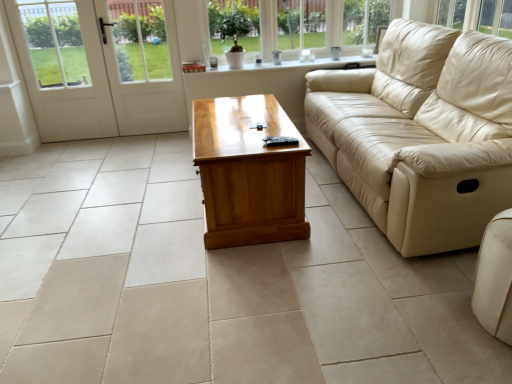
Question: Is clear glass window at upper center facing away from beige leather couch at right, positioned as the 2th studio couch in bottom-to-top order?

Choices:
 (A) no
 (B) yes

Answer: (A)

Question: From a real-world perspective, does clear glass window at upper center stand above beige leather couch at right, the 1th studio couch positioned from the top?

Choices:
 (A) no
 (B) yes

Answer: (B)

Question: From the image's perspective, is clear glass window at upper center on beige leather couch at right, the second studio couch when ordered from front to back?

Choices:
 (A) yes
 (B) no

Answer: (A)

Question: Is the depth of clear glass window at upper center less than that of beige leather couch at right, the 1th studio couch positioned from the top?

Choices:
 (A) yes
 (B) no

Answer: (B)

Question: Is clear glass window at upper center outside beige leather couch at right, marked as the first studio couch in a back-to-front arrangement?

Choices:
 (A) yes
 (B) no

Answer: (A)

Question: Looking at the image, does white wooden screen door at left seem bigger or smaller compared to light brown wood coffee table at center?

Choices:
 (A) big
 (B) small

Answer: (B)

Question: Is white wooden screen door at left inside the boundaries of light brown wood coffee table at center, or outside?

Choices:
 (A) outside
 (B) inside

Answer: (A)

Question: Is point (174, 31) positioned closer to the camera than point (233, 124)?

Choices:
 (A) closer
 (B) farther

Answer: (B)

Question: Based on their positions, is white wooden screen door at left located to the left or right of light brown wood coffee table at center?

Choices:
 (A) right
 (B) left

Answer: (B)

Question: From the image's perspective, relative to white glossy door at left, is beige leather couch at right, marked as the first studio couch in a back-to-front arrangement, above or below?

Choices:
 (A) above
 (B) below

Answer: (B)

Question: Is beige leather couch at right, marked as the first studio couch in a back-to-front arrangement, wider or thinner than white glossy door at left?

Choices:
 (A) thin
 (B) wide

Answer: (B)

Question: From a real-world perspective, is beige leather couch at right, the 1th studio couch positioned from the top, above or below white glossy door at left?

Choices:
 (A) above
 (B) below

Answer: (B)

Question: Is beige leather couch at right, marked as the first studio couch in a back-to-front arrangement, inside or outside of white glossy door at left?

Choices:
 (A) outside
 (B) inside

Answer: (A)

Question: Looking at their shapes, would you say white glossy door at left is wider or thinner than beige leather couch at right, the 1th studio couch positioned from the top?

Choices:
 (A) thin
 (B) wide

Answer: (A)

Question: Does point (161, 24) appear closer or farther from the camera than point (507, 54)?

Choices:
 (A) closer
 (B) farther

Answer: (B)